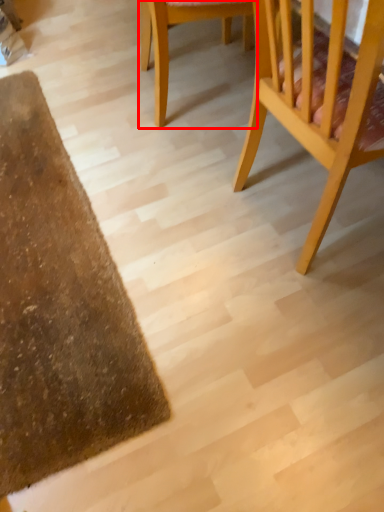
Question: Observing the image, what is the correct spatial positioning of chair (annotated by the red box) in reference to chair?

Choices:
 (A) left
 (B) right

Answer: (A)